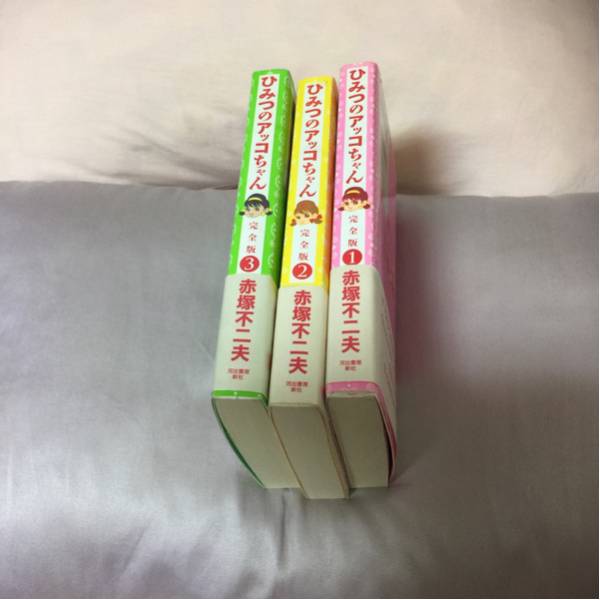
Where is `white bed pillow`? white bed pillow is located at coordinates (131, 319).